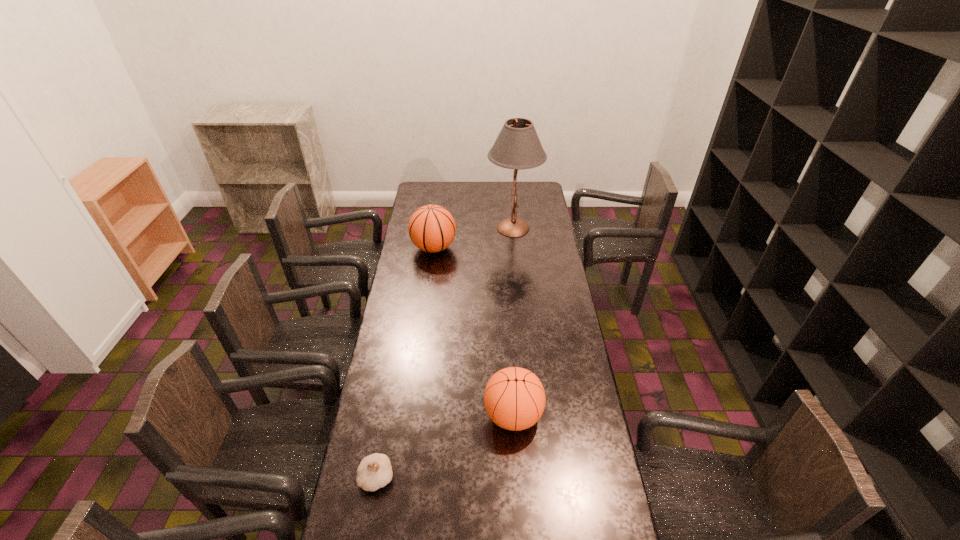
This screenshot has width=960, height=540. In order to click on free space located 0.050m on the right of the farther basketball in this screenshot , I will do `click(467, 248)`.

Locate an element on the screen. This screenshot has width=960, height=540. vacant area situated on the left of the shorter basketball is located at coordinates (398, 415).

Image resolution: width=960 pixels, height=540 pixels. Identify the location of free spot located on the right of the shortest object. (523, 478).

Image resolution: width=960 pixels, height=540 pixels. What are the coordinates of `basketball that is at the left edge` in the screenshot? It's located at (431, 228).

Locate an element on the screen. This screenshot has width=960, height=540. garlic situated at the left edge is located at coordinates (375, 471).

Locate an element on the screen. The height and width of the screenshot is (540, 960). object situated at the right edge is located at coordinates (518, 147).

The image size is (960, 540). What are the coordinates of `vacant space at the far edge of the desktop` in the screenshot? It's located at (458, 201).

The height and width of the screenshot is (540, 960). Identify the location of free space at the left edge of the desktop. (376, 384).

Where is `blank space at the right edge`? blank space at the right edge is located at coordinates (542, 373).

This screenshot has height=540, width=960. In the image, there is a desktop. What are the coordinates of `free space at the far left corner` in the screenshot? It's located at (435, 187).